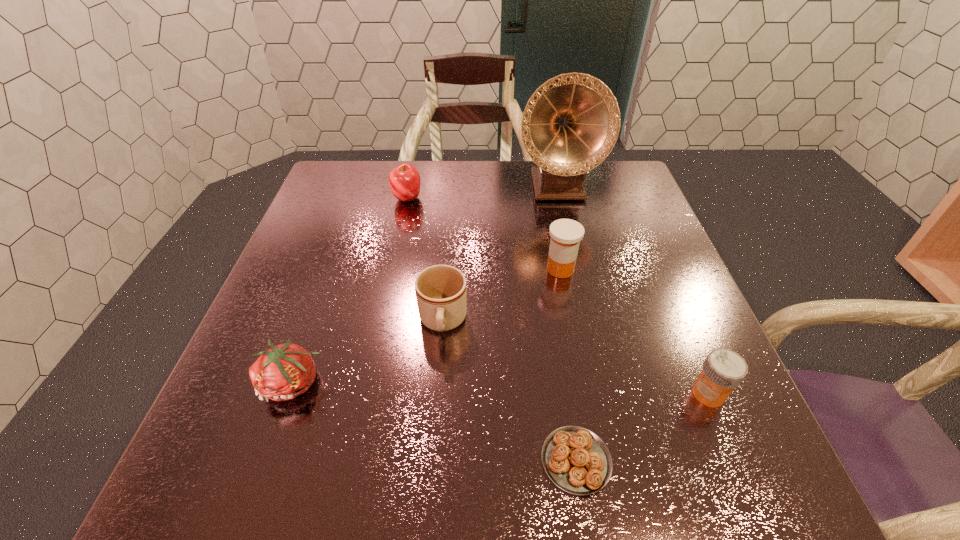
At what (x,y) coordinates should I click in order to perform the action: click on vacant space in between the third farthest object and the nearer medicine. Please return your answer as a coordinate pair (x, y). Looking at the image, I should click on (635, 332).

The width and height of the screenshot is (960, 540). I want to click on free space between the rightmost object and the pastry, so click(x=642, y=427).

Identify the location of free spot between the right medicine and the taller medicine. (635, 332).

Identify the location of object that is the third closest one to the rightmost object. (440, 290).

Find the location of a particular element. Image resolution: width=960 pixels, height=540 pixels. object that ranks as the fourth closest to the farther medicine is located at coordinates (575, 459).

What are the coordinates of `vacant area in the image that satisfies the following two spatial constraints: 1. on the label of the taller medicine; 2. on the front side of the tomato` in the screenshot? It's located at (583, 383).

This screenshot has width=960, height=540. Identify the location of free space in the image that satisfies the following two spatial constraints: 1. on the back side of the sixth object from right to left; 2. on the right side of the leftmost object. (358, 198).

At what (x,y) coordinates should I click in order to perform the action: click on free spot that satisfies the following two spatial constraints: 1. on the label of the taller medicine; 2. on the front side of the nearest object. Please return your answer as a coordinate pair (x, y). The image size is (960, 540). Looking at the image, I should click on (597, 461).

The image size is (960, 540). What are the coordinates of `vacant area in the image that satisfies the following two spatial constraints: 1. on the back side of the leftmost object; 2. on the right side of the second object from left to right` in the screenshot? It's located at (358, 198).

Identify the location of vacant space that satisfies the following two spatial constraints: 1. on the front side of the shortest object; 2. on the right side of the leftmost object. coord(265,461).